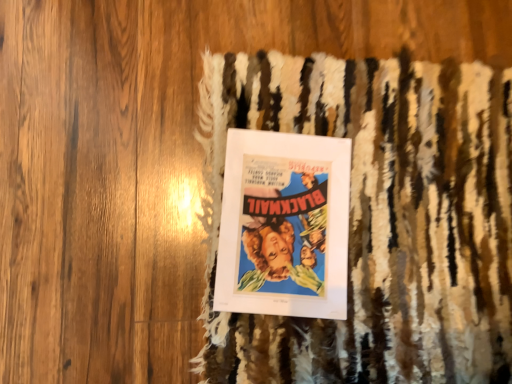
Identify the location of unoccupied area behind vibrant paper poster at center. The width and height of the screenshot is (512, 384). (339, 110).